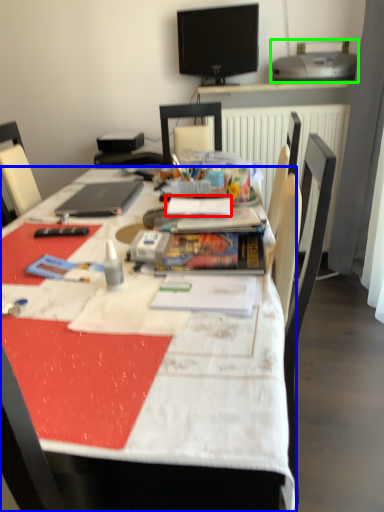
Question: Which is nearer to the paperback book (highlighted by a red box)? desk (highlighted by a blue box) or printer (highlighted by a green box).

Choices:
 (A) desk
 (B) printer

Answer: (A)